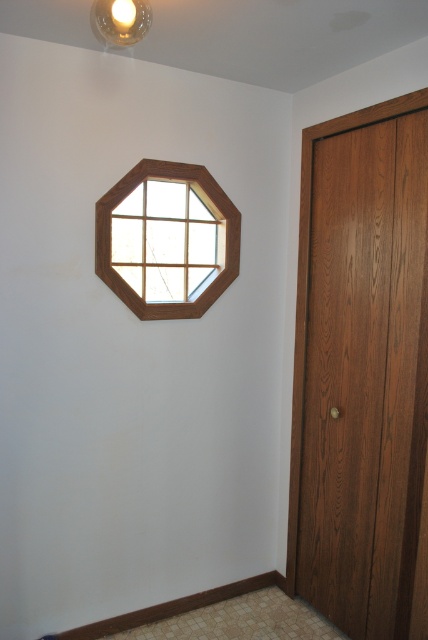
Question: Which object is positioned farthest from the wooden-framed octagonal window at upper center?

Choices:
 (A) matte white bulb at upper center
 (B) wooden door at right

Answer: (A)

Question: Can you confirm if wooden door at right is positioned above matte white bulb at upper center?

Choices:
 (A) no
 (B) yes

Answer: (A)

Question: Which object is closer to the camera taking this photo?

Choices:
 (A) matte white bulb at upper center
 (B) wooden-framed octagonal window at upper center
 (C) wooden door at right

Answer: (A)

Question: Which object is closer to the camera taking this photo?

Choices:
 (A) wooden-framed octagonal window at upper center
 (B) wooden door at right
 (C) matte white bulb at upper center

Answer: (C)

Question: Is wooden door at right wider than matte white bulb at upper center?

Choices:
 (A) yes
 (B) no

Answer: (A)

Question: Where is wooden-framed octagonal window at upper center located in relation to matte white bulb at upper center in the image?

Choices:
 (A) left
 (B) right

Answer: (A)